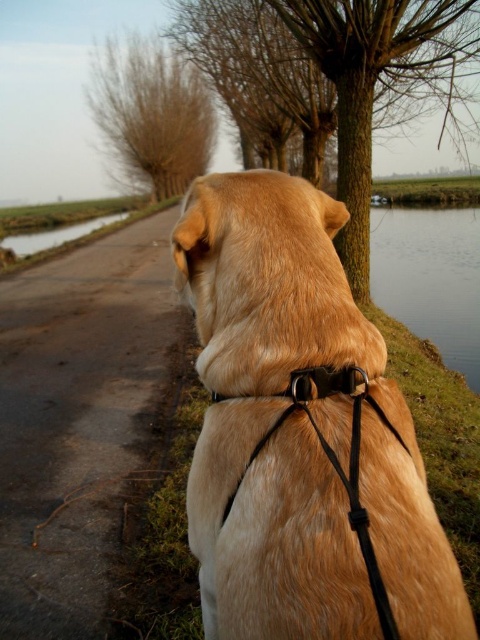
You are a delivery person with a cart that is 10 feet wide. You need to cross the dark asphalt road at center while avoiding the golden fur dog at center. Is there enough space for your cart to pass safely?

The distance between the golden fur dog at center and the dark asphalt road at center is 9.88 feet. Since your cart is 10 feet wide, there is not enough space to pass safely without getting too close to the dog.

You are standing 25 inches away from the golden fur dog at center. If you want to toss a ball to the dog, will you be able to reach it without moving closer?

The golden fur dog at center and viewer are 25.34 inches apart, so yes, you can reach the dog to toss a ball without moving closer since the distance is within a typical throwing range.

You are standing at the point labeled point (189,1) and want to walk towards the dog in the scene. Is the point labeled point (204,296) located in front of you or behind you?

The point labeled point (204,296) is in front of the point labeled point (189,1), so it is located in front of you.